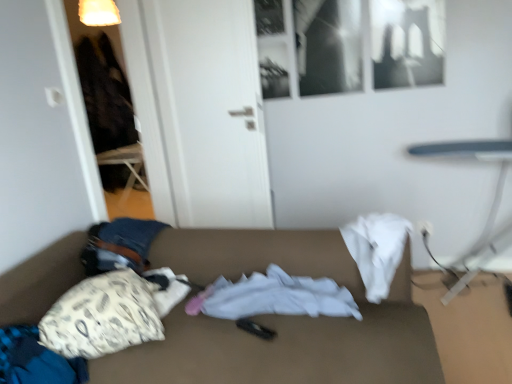
Question: Is white fabric couch at center not within white fabric at center?

Choices:
 (A) no
 (B) yes

Answer: (B)

Question: Can you confirm if white fabric couch at center is bigger than white fabric at center?

Choices:
 (A) no
 (B) yes

Answer: (B)

Question: Can you confirm if white fabric couch at center is smaller than white fabric at center?

Choices:
 (A) yes
 (B) no

Answer: (B)

Question: Is white fabric couch at center behind white fabric at center?

Choices:
 (A) yes
 (B) no

Answer: (B)

Question: Would you say white fabric couch at center is a long distance from white fabric at center?

Choices:
 (A) no
 (B) yes

Answer: (A)

Question: Considering the relative positions of white fabric couch at center and white fabric at center in the image provided, is white fabric couch at center in front of white fabric at center?

Choices:
 (A) no
 (B) yes

Answer: (B)

Question: Could you tell me if white fabric at center is facing white fabric couch at center?

Choices:
 (A) yes
 (B) no

Answer: (A)

Question: Can you confirm if white fabric at center is shorter than white fabric couch at center?

Choices:
 (A) no
 (B) yes

Answer: (B)

Question: From the image's perspective, is white fabric at center located beneath white fabric couch at center?

Choices:
 (A) yes
 (B) no

Answer: (B)

Question: From a real-world perspective, is white fabric at center on top of white fabric couch at center?

Choices:
 (A) no
 (B) yes

Answer: (B)

Question: Is white fabric at center wider than white fabric couch at center?

Choices:
 (A) yes
 (B) no

Answer: (B)

Question: Are white fabric at center and white fabric couch at center located far from each other?

Choices:
 (A) yes
 (B) no

Answer: (B)

Question: Is smooth white table at right to the left of white fabric pillow at lower left from the viewer's perspective?

Choices:
 (A) no
 (B) yes

Answer: (A)